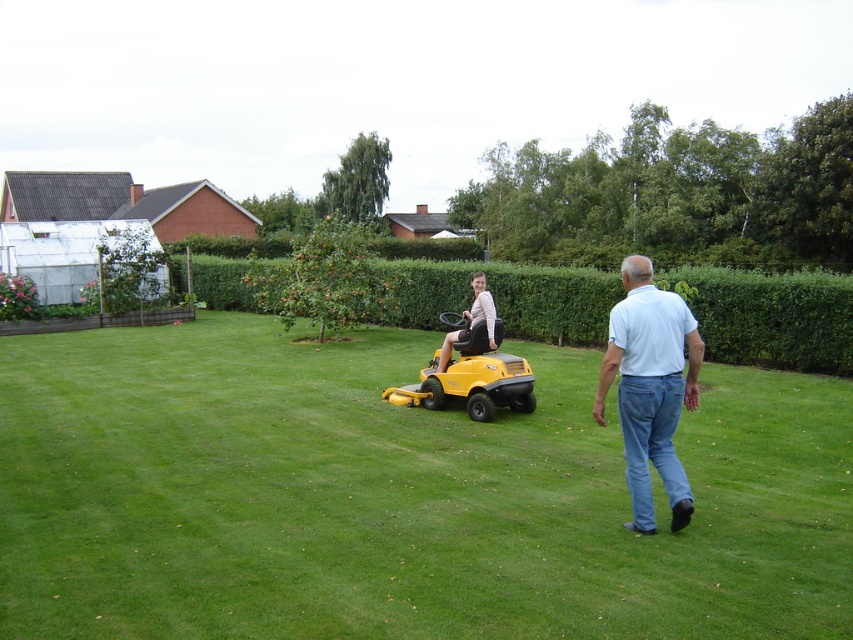
This screenshot has width=853, height=640. What do you see at coordinates (397, 496) in the screenshot?
I see `green grass at center` at bounding box center [397, 496].

Is point (532, 612) closer to camera compared to point (479, 321)?

Yes, it is in front of point (479, 321).

Find the location of `green grass at center`. green grass at center is located at coordinates (397, 496).

Where is `green grass at center`? This screenshot has width=853, height=640. green grass at center is located at coordinates (397, 496).

Between green grass at center and green hedge at center, which one is positioned higher?

green hedge at center is above.

Does green grass at center have a lesser height compared to green hedge at center?

Yes.

Between point (169, 429) and point (706, 337), which one is positioned behind?

The point (706, 337) is behind.

At what (x,y) coordinates should I click in order to perform the action: click on green grass at center. Please return your answer as a coordinate pair (x, y). The image size is (853, 640). Looking at the image, I should click on (397, 496).

Does green hedge at center have a larger size compared to light beige fabric lawn mower at center?

Indeed, green hedge at center has a larger size compared to light beige fabric lawn mower at center.

Find the location of a particular element. green hedge at center is located at coordinates [770, 316].

The image size is (853, 640). I want to click on green hedge at center, so click(x=770, y=316).